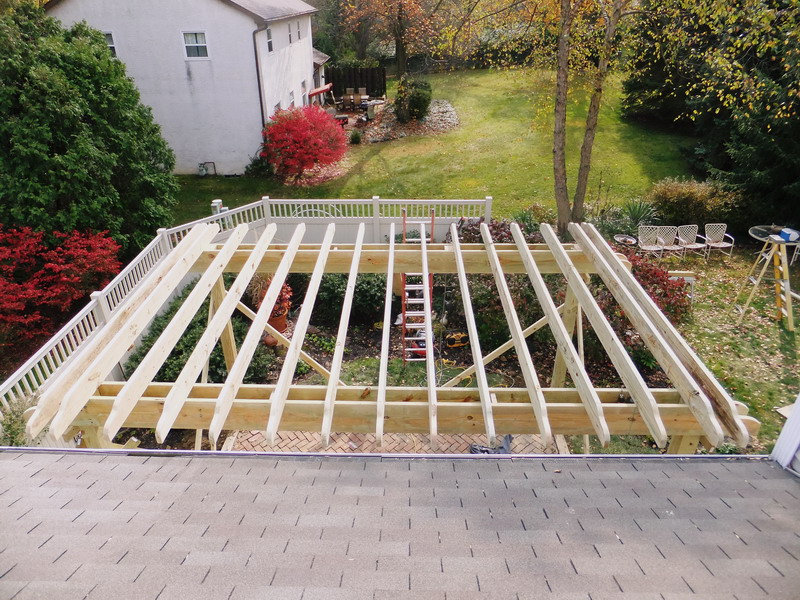
At what (x,y) coordinates should I click in order to perform the action: click on window. Please return your answer as a coordinate pair (x, y). The image size is (800, 600). Looking at the image, I should click on (198, 54).